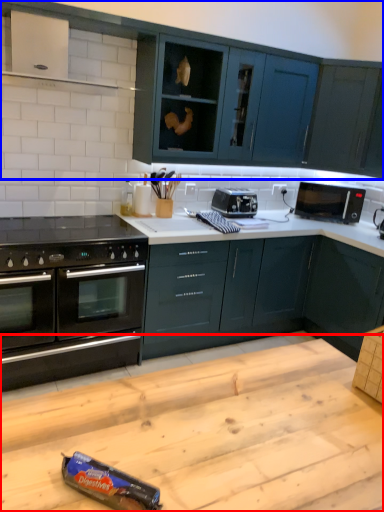
Question: Among these objects, which one is nearest to the camera, table (highlighted by a red box) or cabinetry (highlighted by a blue box)?

Choices:
 (A) table
 (B) cabinetry

Answer: (A)